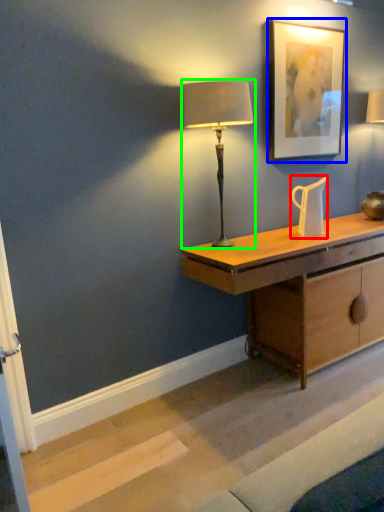
Question: Which object is the closest to the jug (highlighted by a red box)? Choose among these: picture frame (highlighted by a blue box) or lamp (highlighted by a green box).

Choices:
 (A) picture frame
 (B) lamp

Answer: (A)